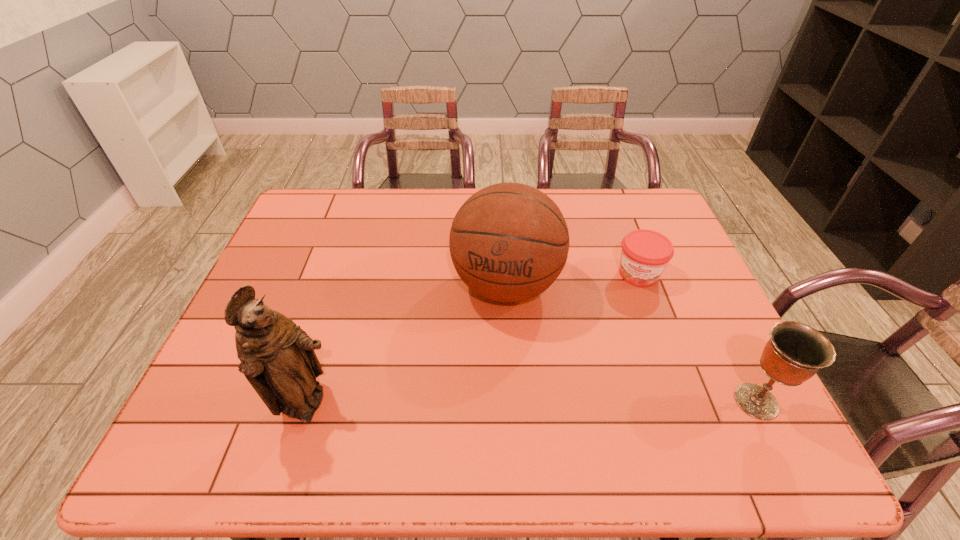
Locate an element on the screen. the leftmost object is located at coordinates point(277,357).

Locate an element on the screen. This screenshot has width=960, height=540. the third tallest object is located at coordinates (795, 352).

Where is `chalice`? The image size is (960, 540). chalice is located at coordinates (795, 352).

Identify the location of the third object from left to right. The height and width of the screenshot is (540, 960). (645, 254).

I want to click on the shortest object, so click(x=645, y=254).

Identify the location of basketball. The width and height of the screenshot is (960, 540). (509, 242).

Find the location of a particular element. Image resolution: width=960 pixels, height=540 pixels. vacant region located 0.360m on the front-facing side of the figurine is located at coordinates (503, 405).

Identify the location of free space located on the left of the chalice. (590, 401).

At what (x,y) coordinates should I click in order to perform the action: click on vacant space located 0.330m on the label side of the jam. Please return your answer as a coordinate pair (x, y). This screenshot has width=960, height=540. Looking at the image, I should click on (606, 383).

What are the coordinates of `vacant area situated 0.360m on the label side of the jam` in the screenshot? It's located at (603, 393).